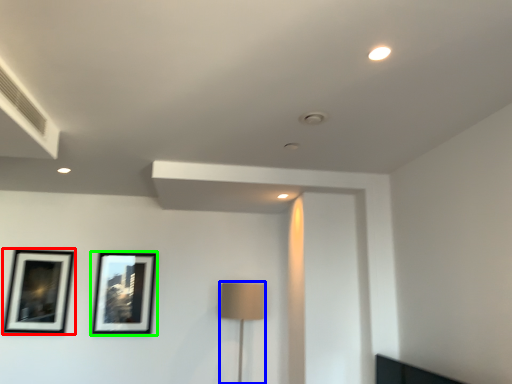
Question: Which object is positioned closest to picture frame (highlighted by a red box)? Select from table lamp (highlighted by a blue box) and picture frame (highlighted by a green box).

Choices:
 (A) table lamp
 (B) picture frame

Answer: (B)